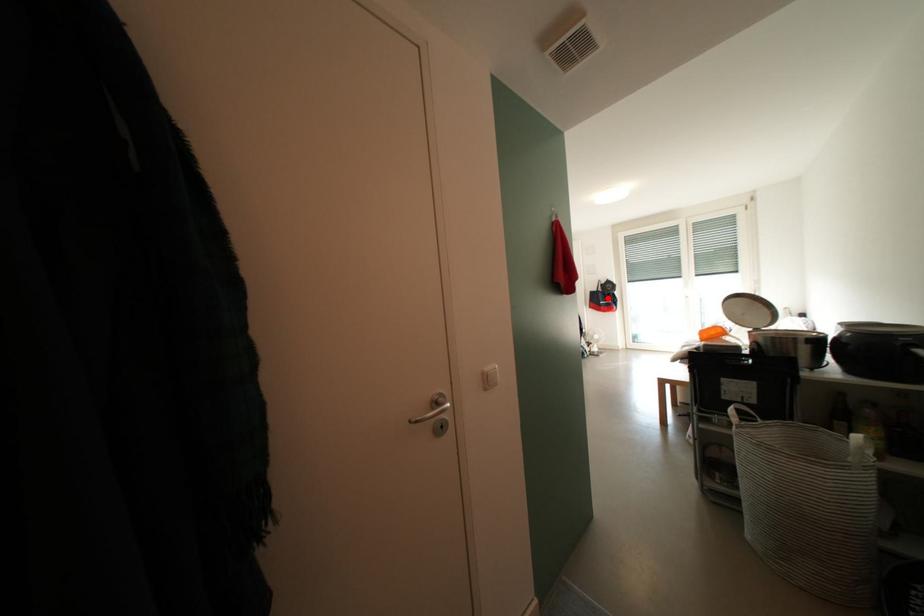
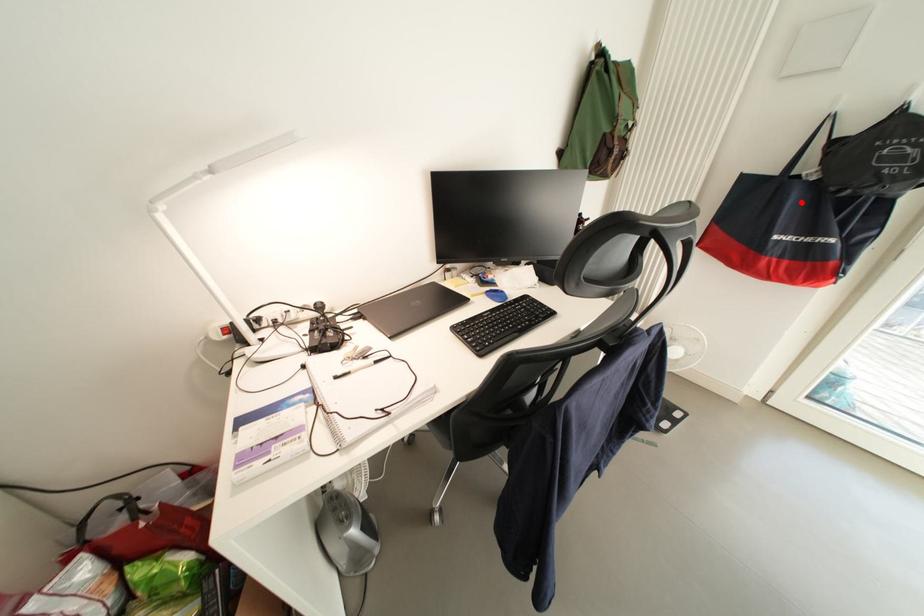
I am providing you with two images of the same scene from different viewpoints. A red point is marked on the first image and another point is marked on the second image. Do the highlighted points in image1 and image2 indicate the same real-world spot?

Yes